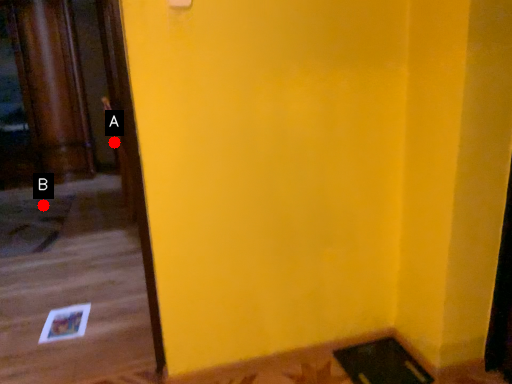
Question: Two points are circled on the image, labeled by A and B beside each circle. Which point is further to the camera?

Choices:
 (A) A is further
 (B) B is further

Answer: (B)